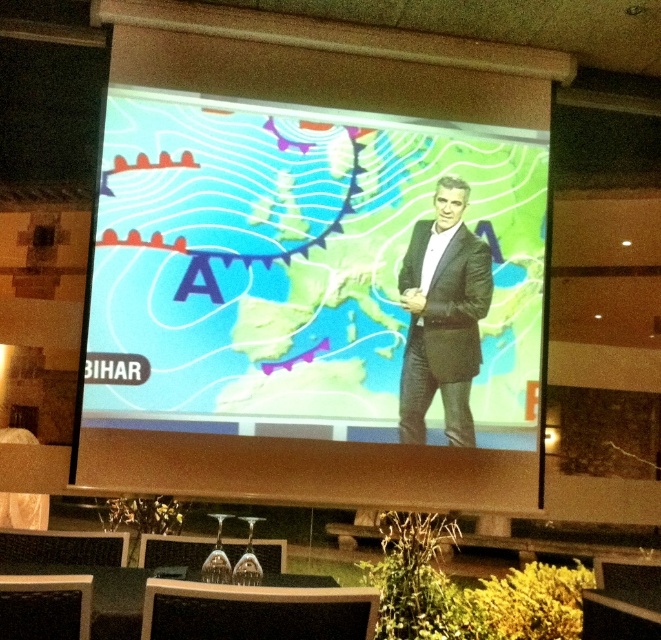
You are attending a weather presentation and notice the matte plastic screen at center and the dark gray suit at center. Which object is taller?

The matte plastic screen at center is taller than the dark gray suit at center.

Based on the photo, you are organizing a conference and need to ensure that the dark gray suit at center can fit on the same table as the matte plastic screen at center. Given that the table is 1.5 meters wide, can both items fit side by side?

The matte plastic screen at center is wider than the dark gray suit at center. However, without knowing the exact widths of both items, it is impossible to determine if they can both fit on a 1.5 meter wide table.